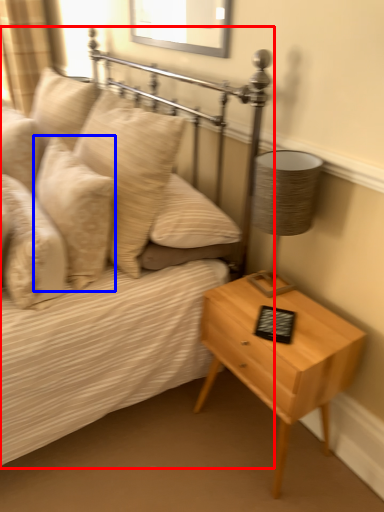
Question: Which object is further to the camera taking this photo, bed (highlighted by a red box) or pillow (highlighted by a blue box)?

Choices:
 (A) bed
 (B) pillow

Answer: (B)